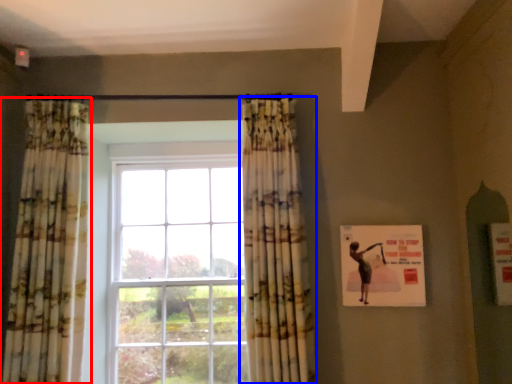
Question: Which object appears closest to the camera in this image, curtain (highlighted by a red box) or curtain (highlighted by a blue box)?

Choices:
 (A) curtain
 (B) curtain

Answer: (B)